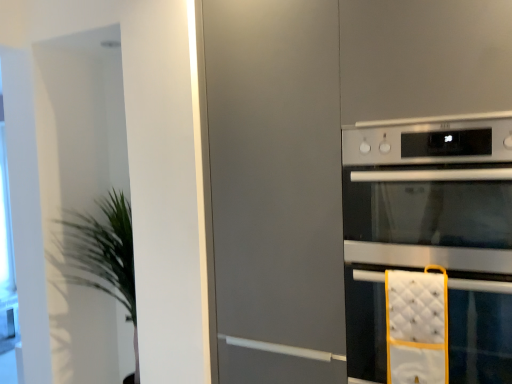
Question: Is satin silver oven at right to the left or to the right of green leafy plant at left in the image?

Choices:
 (A) right
 (B) left

Answer: (A)

Question: Is satin silver oven at right in front of or behind green leafy plant at left in the image?

Choices:
 (A) behind
 (B) front

Answer: (B)

Question: Which of these objects is positioned closest to the green leafy plant at left?

Choices:
 (A) satin silver oven at right
 (B) silver metallic oven at right

Answer: (A)

Question: Estimate the real-world distances between objects in this image. Which object is closer to the satin silver oven at right?

Choices:
 (A) silver metallic oven at right
 (B) green leafy plant at left

Answer: (A)